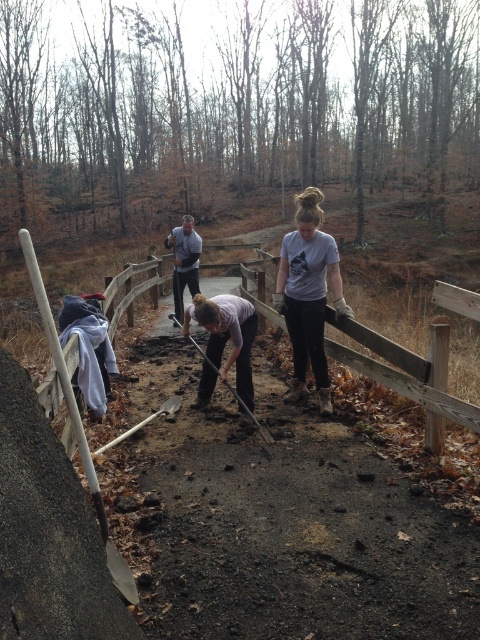
Question: Where is light gray t-shirt at center located in relation to dark gray pants at center in the image?

Choices:
 (A) above
 (B) below

Answer: (B)

Question: Which of these objects is positioned closest to the light gray t-shirt at center?

Choices:
 (A) dark gray pants at center
 (B) light gray fabric shirt at center

Answer: (B)

Question: Is light gray t-shirt at center bigger than dark gray pants at center?

Choices:
 (A) no
 (B) yes

Answer: (A)

Question: Which of the following is the closest to the observer?

Choices:
 (A) (200, 243)
 (B) (319, 344)
 (C) (208, 349)

Answer: (B)

Question: Which object appears closest to the camera in this image?

Choices:
 (A) dark gray pants at center
 (B) light gray fabric shirt at center

Answer: (B)

Question: In this image, where is light gray t-shirt at center located relative to light gray fabric shirt at center?

Choices:
 (A) below
 (B) above

Answer: (B)